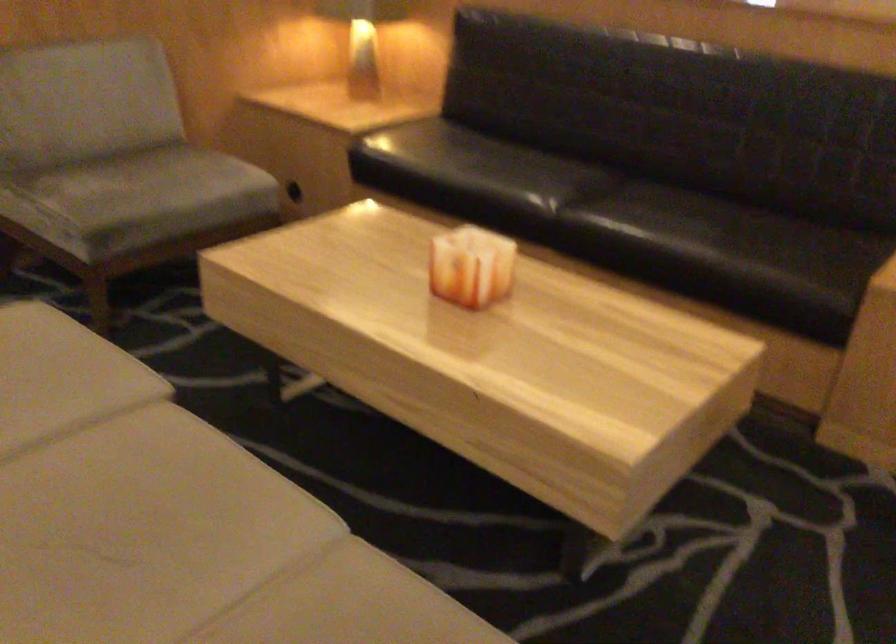
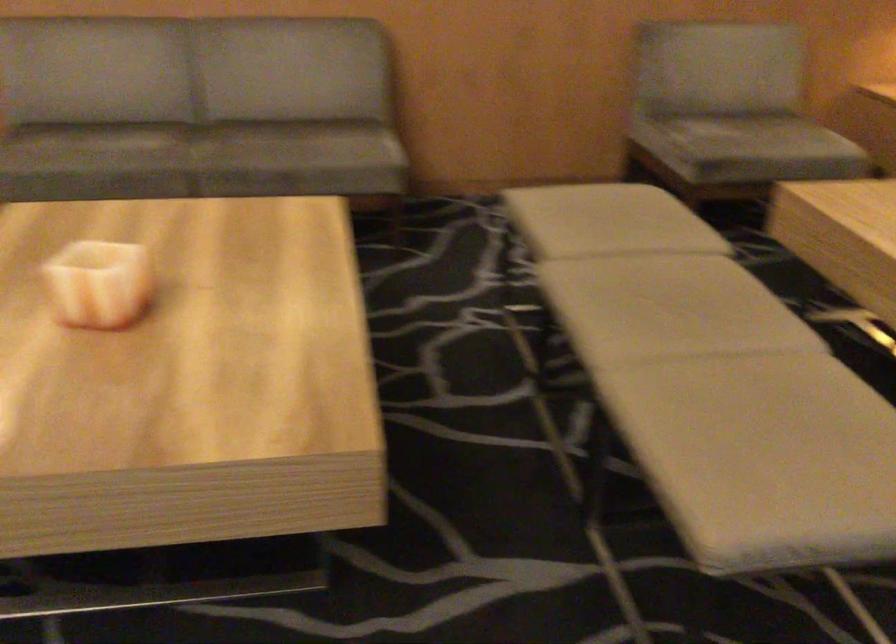
Find the pixel in the second image that matches point (138, 198) in the first image.

(744, 138)